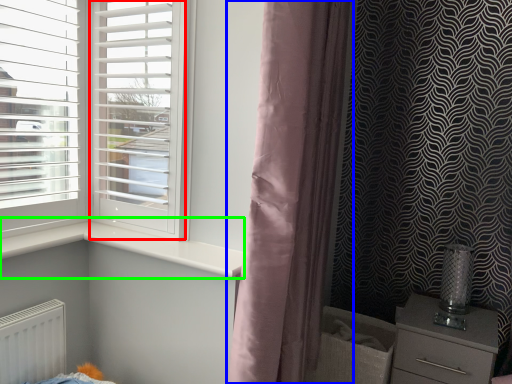
Question: Based on their relative distances, which object is farther from screen door (highlighted by a red box)? Choose from curtain (highlighted by a blue box) and window sill (highlighted by a green box).

Choices:
 (A) curtain
 (B) window sill

Answer: (A)